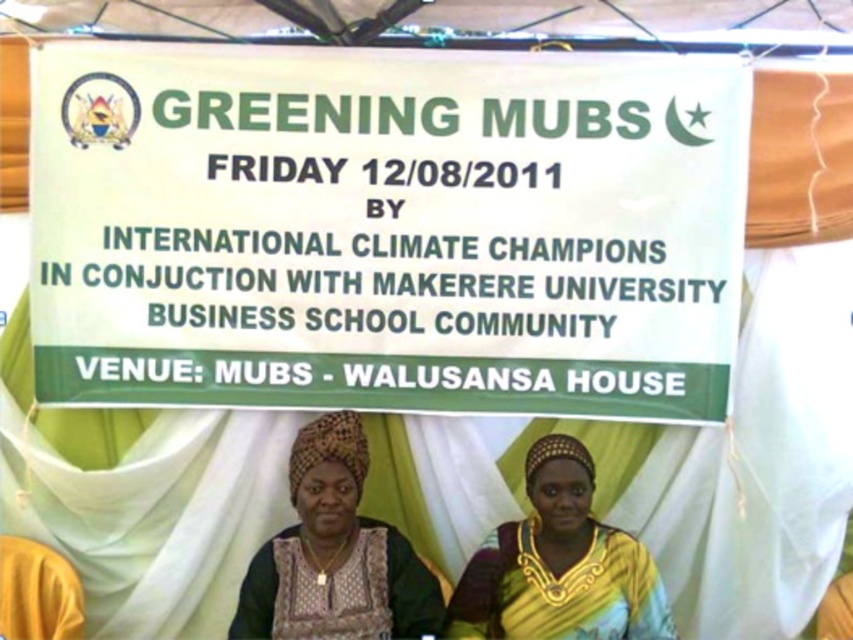
Question: Which point is farther to the camera?

Choices:
 (A) (380, 529)
 (B) (488, 547)
 (C) (697, 280)

Answer: (C)

Question: Is white paper sign at center closer to camera compared to black woven fabric headscarf at center?

Choices:
 (A) yes
 (B) no

Answer: (B)

Question: Which object is closer to the camera taking this photo?

Choices:
 (A) yellow fabric headscarf at center
 (B) white paper sign at center
 (C) black woven fabric headscarf at center

Answer: (C)

Question: Estimate the real-world distances between objects in this image. Which object is farther from the white paper sign at center?

Choices:
 (A) yellow fabric headscarf at center
 (B) black woven fabric headscarf at center

Answer: (A)

Question: Observing the image, what is the correct spatial positioning of white paper sign at center in reference to yellow fabric headscarf at center?

Choices:
 (A) left
 (B) right

Answer: (A)

Question: Can you confirm if white paper sign at center is thinner than black woven fabric headscarf at center?

Choices:
 (A) yes
 (B) no

Answer: (B)